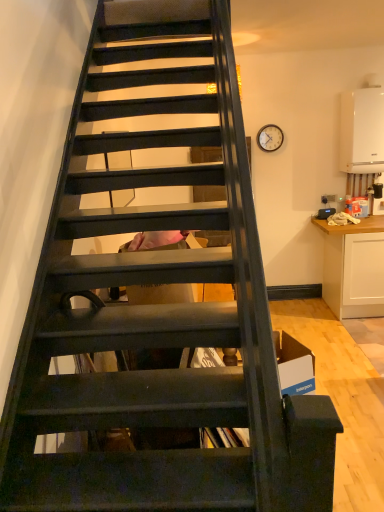
Question: Does white matte boiler at upper right have a greater height compared to matte brown clock at upper right?

Choices:
 (A) yes
 (B) no

Answer: (A)

Question: Is white matte boiler at upper right looking in the opposite direction of matte brown clock at upper right?

Choices:
 (A) yes
 (B) no

Answer: (B)

Question: Are white matte boiler at upper right and matte brown clock at upper right making contact?

Choices:
 (A) no
 (B) yes

Answer: (A)

Question: Is white matte boiler at upper right positioned beyond the bounds of matte brown clock at upper right?

Choices:
 (A) no
 (B) yes

Answer: (B)

Question: Is matte brown clock at upper right inside white matte boiler at upper right?

Choices:
 (A) no
 (B) yes

Answer: (A)

Question: Is white matte cabinet at right taller or shorter than matte brown clock at upper right?

Choices:
 (A) tall
 (B) short

Answer: (A)

Question: In the image, is white matte cabinet at right on the left side or the right side of matte brown clock at upper right?

Choices:
 (A) left
 (B) right

Answer: (B)

Question: Considering the positions of white matte cabinet at right and matte brown clock at upper right in the image, is white matte cabinet at right bigger or smaller than matte brown clock at upper right?

Choices:
 (A) small
 (B) big

Answer: (B)

Question: Choose the correct answer: Is white matte cabinet at right inside matte brown clock at upper right or outside it?

Choices:
 (A) outside
 (B) inside

Answer: (A)

Question: Considering their positions, is white matte boiler at upper right located in front of or behind matte brown clock at upper right?

Choices:
 (A) behind
 (B) front

Answer: (B)

Question: From the image's perspective, is white matte boiler at upper right located above or below matte brown clock at upper right?

Choices:
 (A) above
 (B) below

Answer: (A)

Question: Considering the positions of white matte boiler at upper right and matte brown clock at upper right in the image, is white matte boiler at upper right bigger or smaller than matte brown clock at upper right?

Choices:
 (A) small
 (B) big

Answer: (B)

Question: Is point (355, 151) positioned closer to the camera than point (269, 143)?

Choices:
 (A) farther
 (B) closer

Answer: (B)

Question: In terms of size, does white matte cabinet at right appear bigger or smaller than white matte boiler at upper right?

Choices:
 (A) big
 (B) small

Answer: (A)

Question: From the image's perspective, is white matte cabinet at right above or below white matte boiler at upper right?

Choices:
 (A) below
 (B) above

Answer: (A)